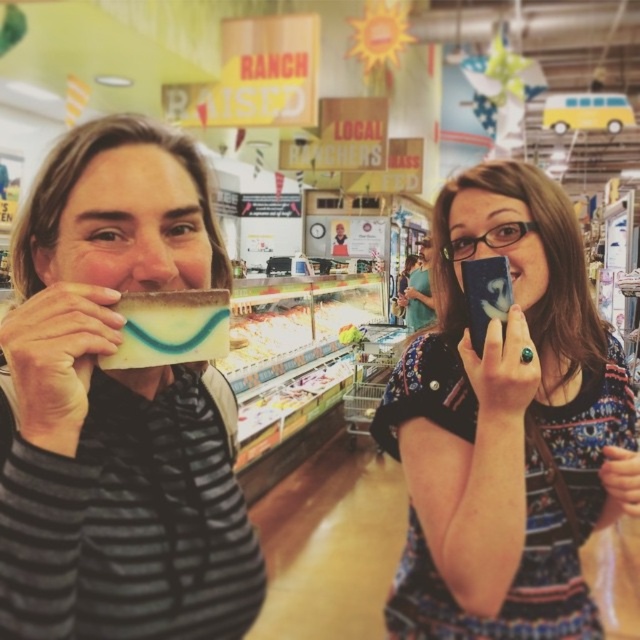
You are trying to decide which item to place in a small pouch that can only hold items smaller than the other. Given the items are the matte black phone at center and the transparent plastic glasses at upper center, which one should you choose?

The transparent plastic glasses at upper center should be chosen because the matte black phone at center is bigger than transparent plastic glasses at upper center, making the glasses smaller and thus suitable for the pouch.

You are standing in the grocery store dairy section and see two points marked on the floor. The first point is at coordinates point (10, 428) and the second point is at point (355, 333). Which point is closer to you?

Point (10, 428) is in front of point (355, 333), so it is closer to you.

You are a delivery person who needs to place the matte yellow cheese at left into the smooth plastic container at center. Given that your delivery cart is 4 meters long, can you place the cheese on the cart without moving the cart?

The matte yellow cheese at left is 3.75 meters from the smooth plastic container at center, so yes, the delivery person can place the matte yellow cheese at left into the smooth plastic container at center on the cart since the distance is within the cart length.